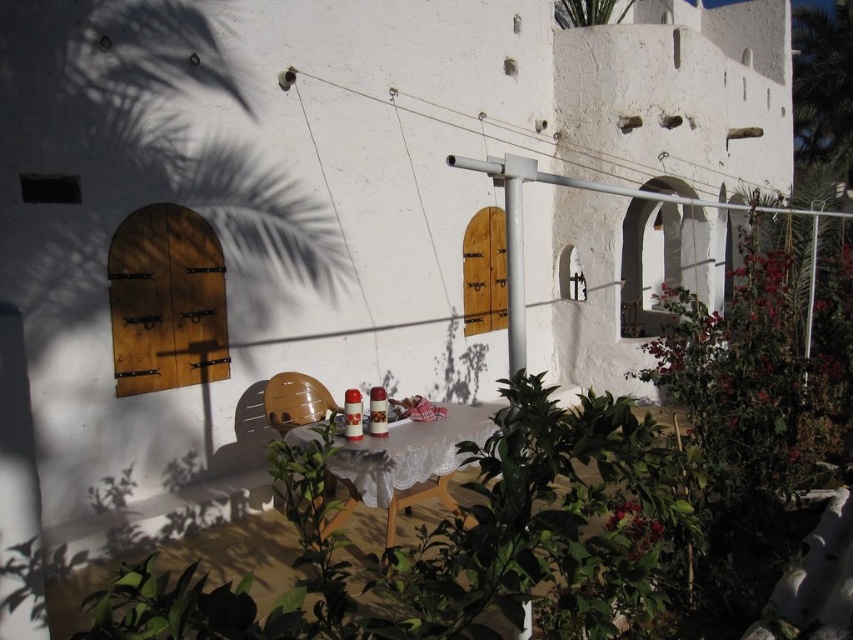
You are setting up a picnic table in the described outdoor area. The white lace tablecloth at center and the green leafy plant at upper center are both on the table. Which object is taller?

The white lace tablecloth at center is taller than the green leafy plant at upper center.

You are standing in front of the white, textured wall with arched wooden doors and windows. There are two points marked on the wall at coordinates point [471,524] and point [621,19]. Which point is closer to you?

Point [471,524] is closer to the viewer than point [621,19].